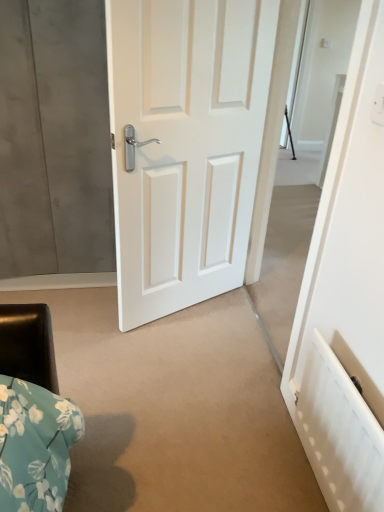
Question: Is white textured radiator at lower right not within white glossy door at center?

Choices:
 (A) yes
 (B) no

Answer: (A)

Question: Is white textured radiator at lower right shorter than white glossy door at center?

Choices:
 (A) yes
 (B) no

Answer: (A)

Question: Is white glossy door at center a part of white textured radiator at lower right?

Choices:
 (A) no
 (B) yes

Answer: (A)

Question: Considering the relative sizes of white textured radiator at lower right and white glossy door at center in the image provided, is white textured radiator at lower right wider than white glossy door at center?

Choices:
 (A) yes
 (B) no

Answer: (B)

Question: Is white textured radiator at lower right at the left side of white glossy door at center?

Choices:
 (A) yes
 (B) no

Answer: (B)

Question: Does point (256, 59) appear closer or farther from the camera than point (329, 351)?

Choices:
 (A) closer
 (B) farther

Answer: (B)

Question: Considering the positions of white glossy door at center and white textured radiator at lower right in the image, is white glossy door at center wider or thinner than white textured radiator at lower right?

Choices:
 (A) wide
 (B) thin

Answer: (A)

Question: Based on their sizes in the image, would you say white glossy door at center is bigger or smaller than white textured radiator at lower right?

Choices:
 (A) big
 (B) small

Answer: (A)

Question: Is white glossy door at center in front of or behind white textured radiator at lower right in the image?

Choices:
 (A) behind
 (B) front

Answer: (A)

Question: Considering the positions of matte white door at center and white textured radiator at lower right in the image, is matte white door at center wider or thinner than white textured radiator at lower right?

Choices:
 (A) wide
 (B) thin

Answer: (A)

Question: Relative to white textured radiator at lower right, is matte white door at center in front or behind?

Choices:
 (A) front
 (B) behind

Answer: (B)

Question: Choose the correct answer: Is matte white door at center inside white textured radiator at lower right or outside it?

Choices:
 (A) inside
 (B) outside

Answer: (B)

Question: Visually, is matte white door at center positioned to the left or to the right of white textured radiator at lower right?

Choices:
 (A) left
 (B) right

Answer: (A)

Question: Considering the positions of matte white door at center and white glossy door at center in the image, is matte white door at center wider or thinner than white glossy door at center?

Choices:
 (A) thin
 (B) wide

Answer: (B)

Question: Considering the positions of matte white door at center and white glossy door at center in the image, is matte white door at center taller or shorter than white glossy door at center?

Choices:
 (A) tall
 (B) short

Answer: (B)